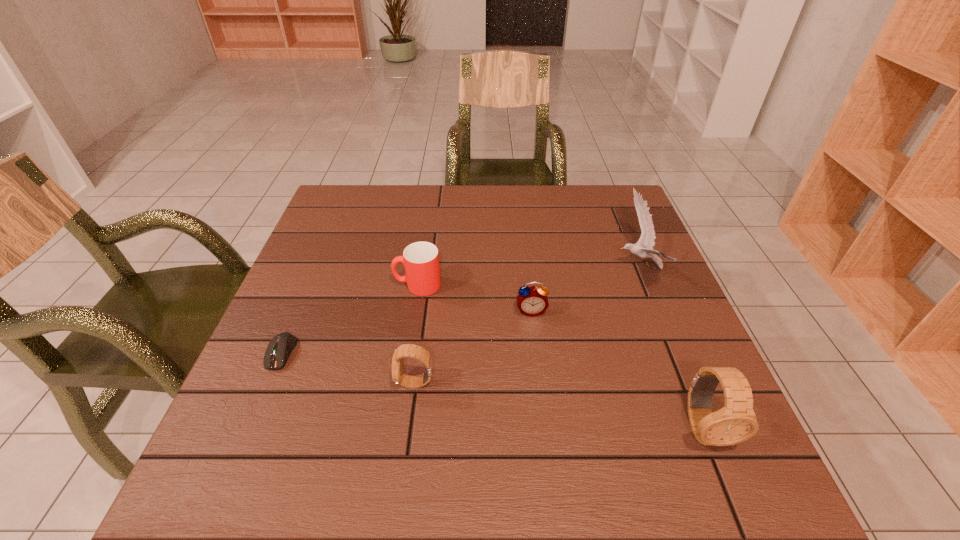
The image size is (960, 540). In order to click on object that is at the near edge in this screenshot , I will do `click(736, 422)`.

Find the location of a particular element. Image resolution: width=960 pixels, height=540 pixels. object that is at the left edge is located at coordinates (278, 350).

The image size is (960, 540). I want to click on watch at the right edge, so click(x=736, y=422).

This screenshot has width=960, height=540. Find the location of `gull at the right edge`. gull at the right edge is located at coordinates [x=643, y=248].

I want to click on object that is at the near right corner, so click(736, 422).

In the image, there is a desktop. Identify the location of vacant space at the far edge. (441, 226).

Locate an element on the screen. free region at the left edge of the desktop is located at coordinates (372, 231).

Find the location of a particular element. vacant area at the right edge is located at coordinates (654, 263).

Locate an element on the screen. This screenshot has width=960, height=540. free space at the far left corner of the desktop is located at coordinates click(x=365, y=212).

Image resolution: width=960 pixels, height=540 pixels. Find the location of `vacant point at the far right corner`. vacant point at the far right corner is located at coordinates (629, 194).